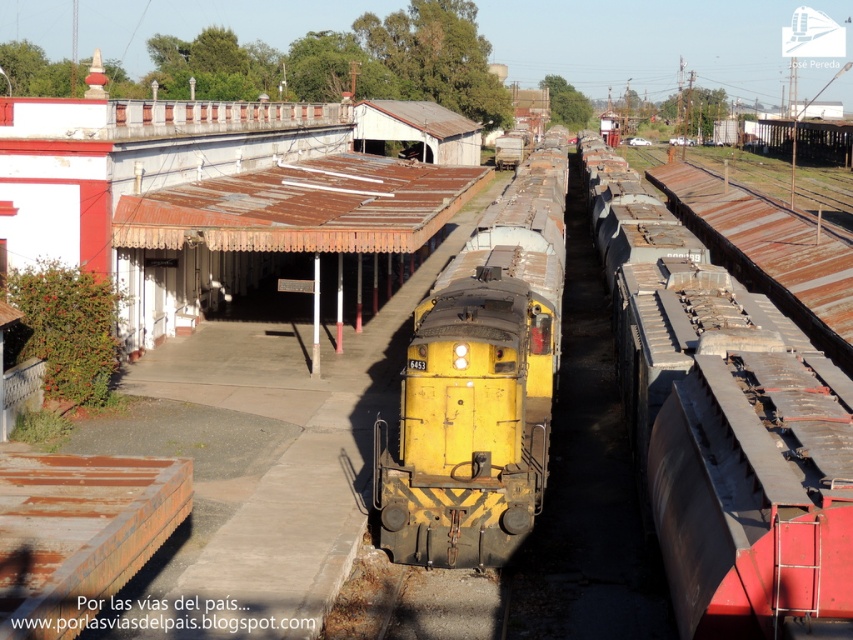
You are a passenger waiting on the platform at the railway station. You see the rusty metal train car at right and the yellow matte train at center. Which one is closer to you?

The rusty metal train car at right is in front of the yellow matte train at center, so it is closer to you.

You are a passenger waiting on the platform at the railway station. You see two points marked on the ground ahead of you. The first point is labeled as point (x=680, y=227) and the second is point (x=469, y=541). If you are facing the direction the train is moving, which point is closer to the front of the train?

Point (x=469, y=541) is closer to the front of the train because point (x=680, y=227) is behind it.